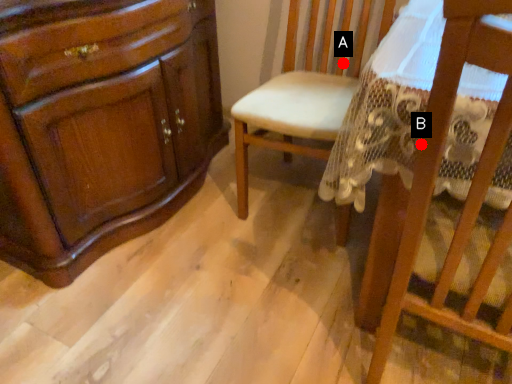
Question: Two points are circled on the image, labeled by A and B beside each circle. Which point appears farthest from the camera in this image?

Choices:
 (A) A is further
 (B) B is further

Answer: (A)